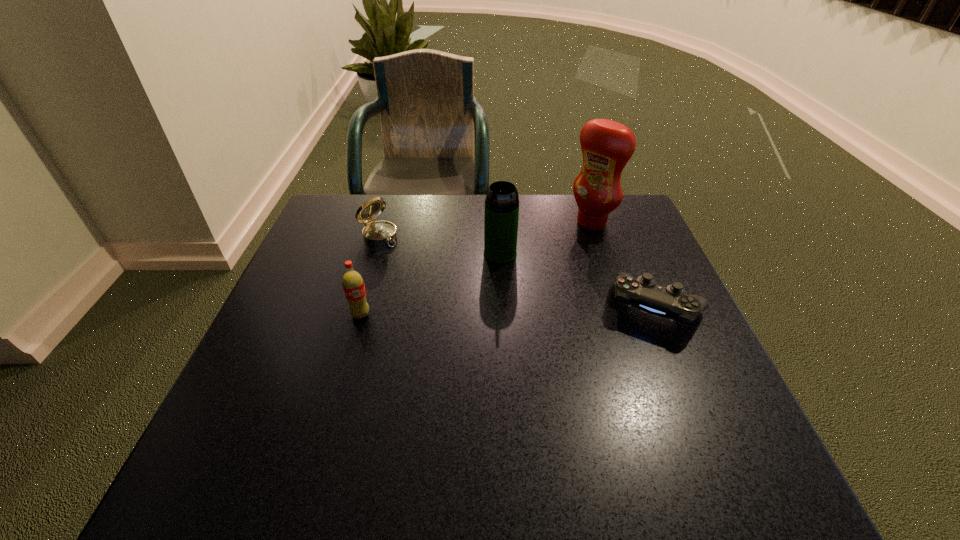
Where is `vacant space located 0.260m with the dial facing the compass`? The height and width of the screenshot is (540, 960). vacant space located 0.260m with the dial facing the compass is located at coordinates (455, 294).

This screenshot has width=960, height=540. I want to click on vacant space positioned on the label side of the condiment, so click(x=519, y=278).

Find the location of a particular element. free region located on the label side of the condiment is located at coordinates (541, 260).

You are a GUI agent. You are given a task and a screenshot of the screen. Output one action in this format:
    pyautogui.click(x=<x>, y=<y>)
    Task: Click on the vacant point located on the label side of the condiment
    The image size is (960, 540).
    Given the screenshot: What is the action you would take?
    pyautogui.click(x=561, y=246)

The height and width of the screenshot is (540, 960). What are the coordinates of `vacant space located 0.220m from the spout of the thermos bottle` in the screenshot? It's located at (510, 330).

Find the location of a particular element. Image resolution: width=960 pixels, height=540 pixels. vacant space located from the spout of the thermos bottle is located at coordinates (504, 286).

You are a GUI agent. You are given a task and a screenshot of the screen. Output one action in this format:
    pyautogui.click(x=<x>, y=<y>)
    Task: Click on the vacant space located from the spout of the thermos bottle
    This screenshot has height=540, width=960.
    Given the screenshot: What is the action you would take?
    pyautogui.click(x=516, y=373)

The image size is (960, 540). What are the coordinates of `compass that is at the far edge` in the screenshot? It's located at (375, 233).

What are the coordinates of `condiment that is positioned at the far edge` in the screenshot? It's located at (607, 146).

Find the location of `object situated at the left edge`. object situated at the left edge is located at coordinates (375, 233).